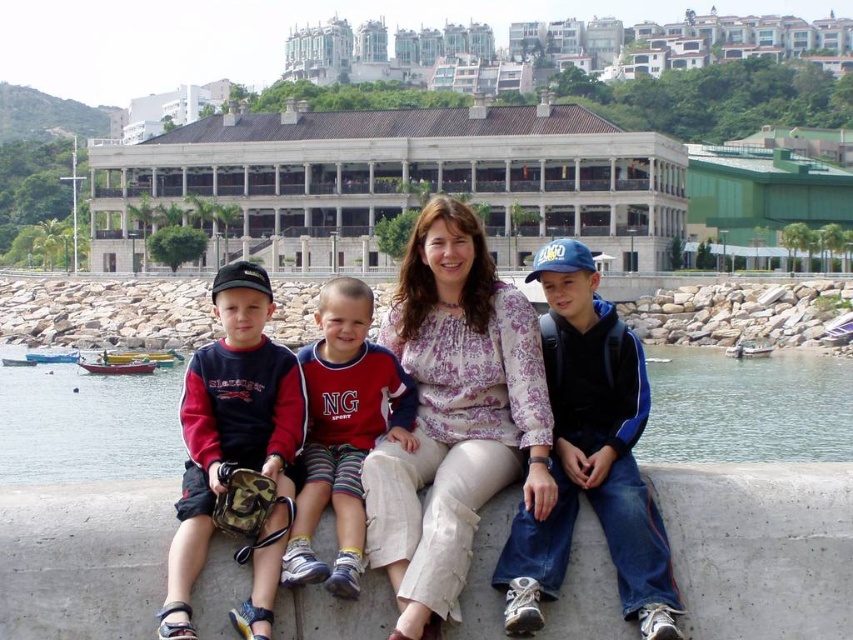
You are standing in front of the waterfront scene and want to take a photo that includes both point A at point (440, 460) and point B at point (355, 436). Which point should you focus on to ensure both points are in sharp focus?

You should focus on point B at point (355, 436) because it is farther from the camera than point A at point (440, 460). By focusing on the farther point, the depth of field will include the closer point as well, ensuring both are in sharp focus.

You are a photographer trying to capture a candid shot of the group without them noticing. You want to focus on the person wearing the matte blue jacket at center and the blue denim jeans at center. Which clothing item is positioned higher on their body?

The matte blue jacket at center is above the blue denim jeans at center, so the jacket is higher on their body.